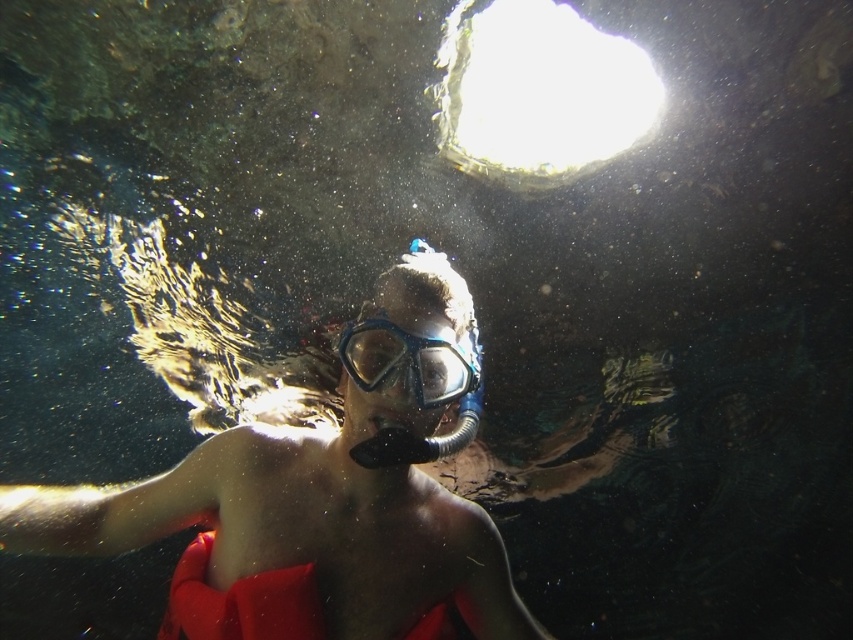
Between point (373, 524) and point (402, 400), which one is positioned behind?

Positioned behind is point (373, 524).

Is point (144, 508) closer to camera compared to point (480, 390)?

Yes, it is in front of point (480, 390).

The image size is (853, 640). What are the coordinates of `matte skin diver at center` in the screenshot? It's located at (317, 499).